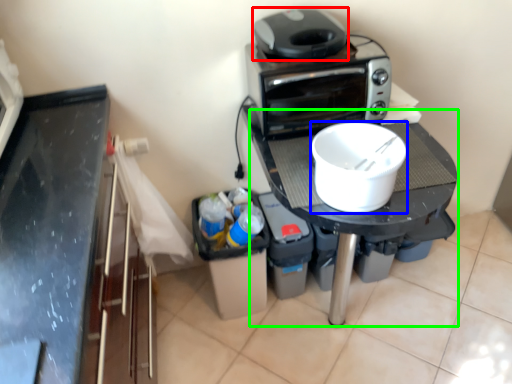
Question: Which object is positioned farthest from home appliance (highlighted by a red box)? Select from kitchen appliance (highlighted by a blue box) and table (highlighted by a green box).

Choices:
 (A) kitchen appliance
 (B) table

Answer: (B)